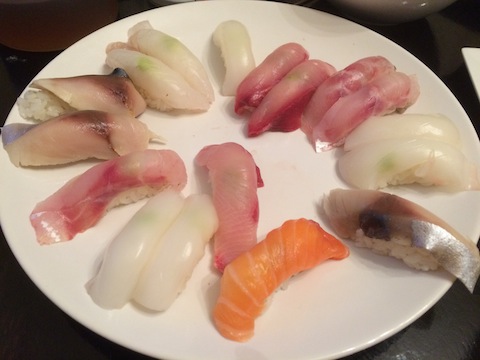
Find the location of a particular element. table is located at coordinates pos(437,338).